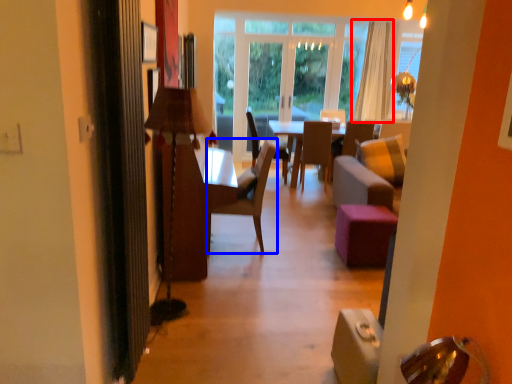
Question: Among these objects, which one is farthest to the camera, curtain (highlighted by a red box) or chair (highlighted by a blue box)?

Choices:
 (A) curtain
 (B) chair

Answer: (A)